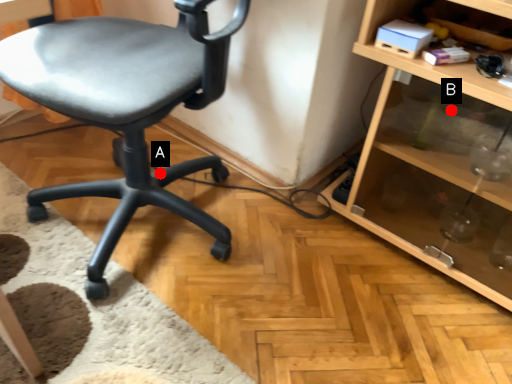
Question: Two points are circled on the image, labeled by A and B beside each circle. Which point is closer to the camera taking this photo?

Choices:
 (A) A is closer
 (B) B is closer

Answer: (B)